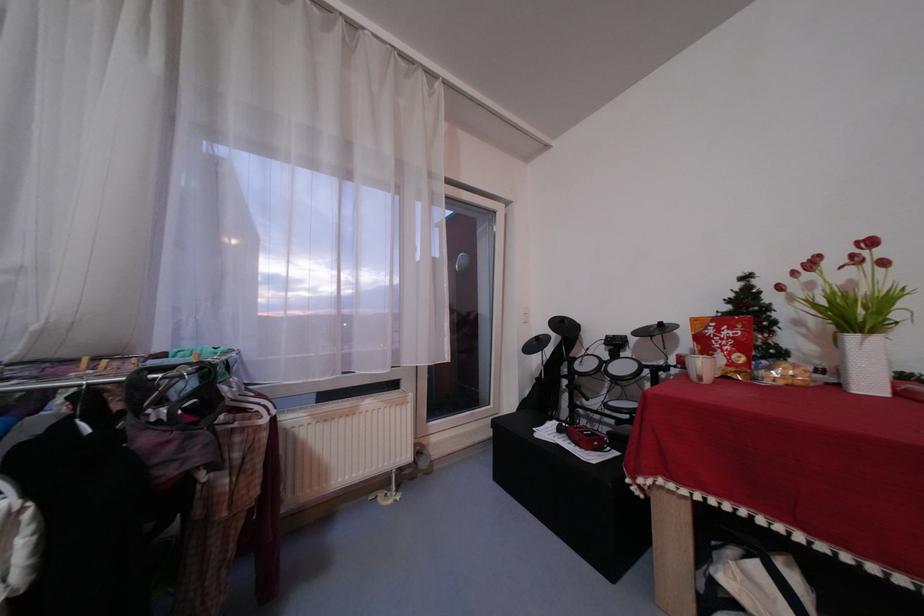
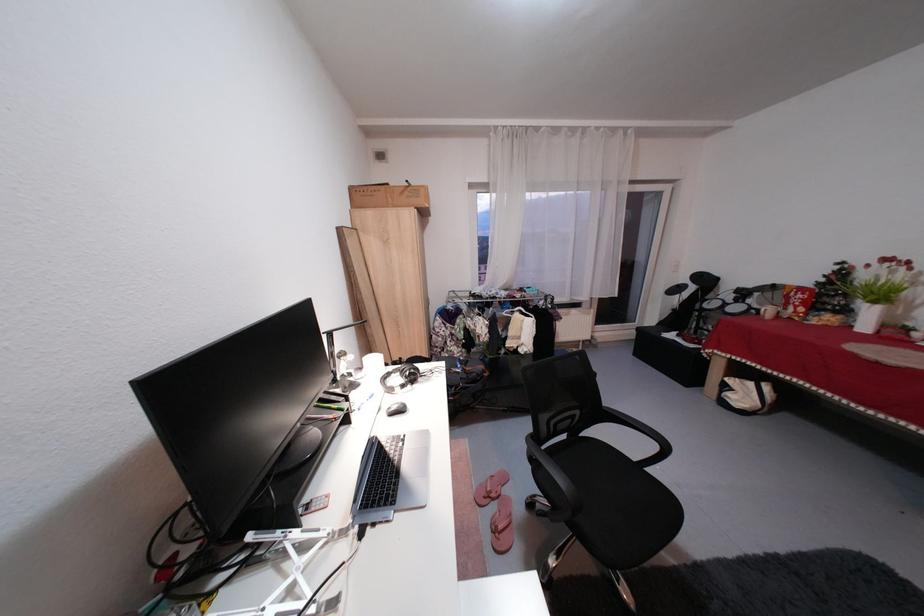
Where in the second image is the point corresponding to the point at 736,379 from the first image?

(800, 320)